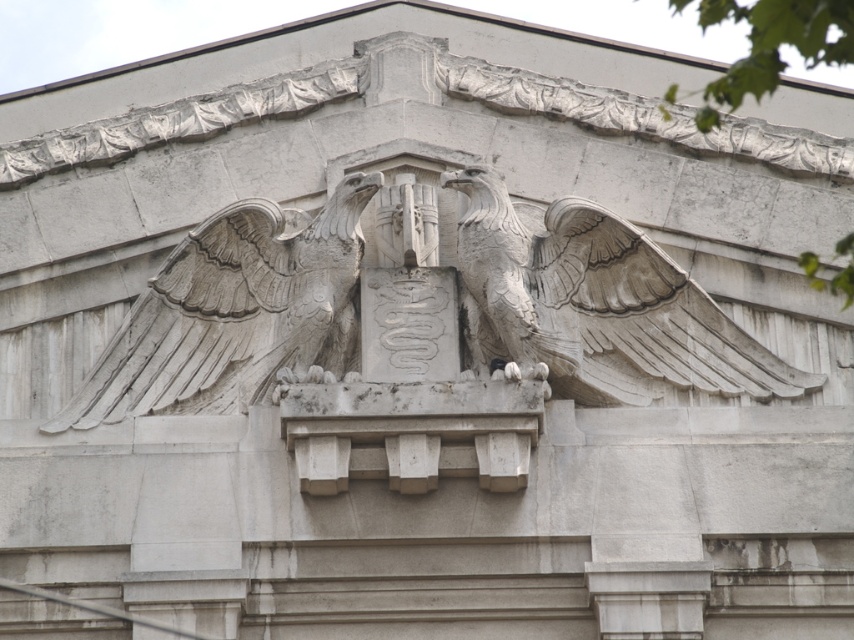
Locate an element on the screen. The width and height of the screenshot is (854, 640). gray stone eagle at center is located at coordinates (234, 312).

Where is `gray stone eagle at center`? Image resolution: width=854 pixels, height=640 pixels. gray stone eagle at center is located at coordinates (234, 312).

Is point (607, 314) farther from camera compared to point (630, 237)?

Yes, point (607, 314) is behind point (630, 237).

Which is in front, point (199, 349) or point (712, 356)?

Point (712, 356) is more forward.

Locate an element on the screen. This screenshot has width=854, height=640. white stone eagle at center is located at coordinates (589, 305).

Is white stone eagle at center bigger than gray stone eagle at center?

Yes, white stone eagle at center is bigger than gray stone eagle at center.

Does white stone eagle at center have a greater width compared to gray stone eagle at center?

Indeed, white stone eagle at center has a greater width compared to gray stone eagle at center.

Does point (404, 211) come closer to viewer compared to point (164, 412)?

That is False.

At what (x,y) coordinates should I click in order to perform the action: click on white stone eagle at center. Please return your answer as a coordinate pair (x, y). Image resolution: width=854 pixels, height=640 pixels. Looking at the image, I should click on (589, 305).